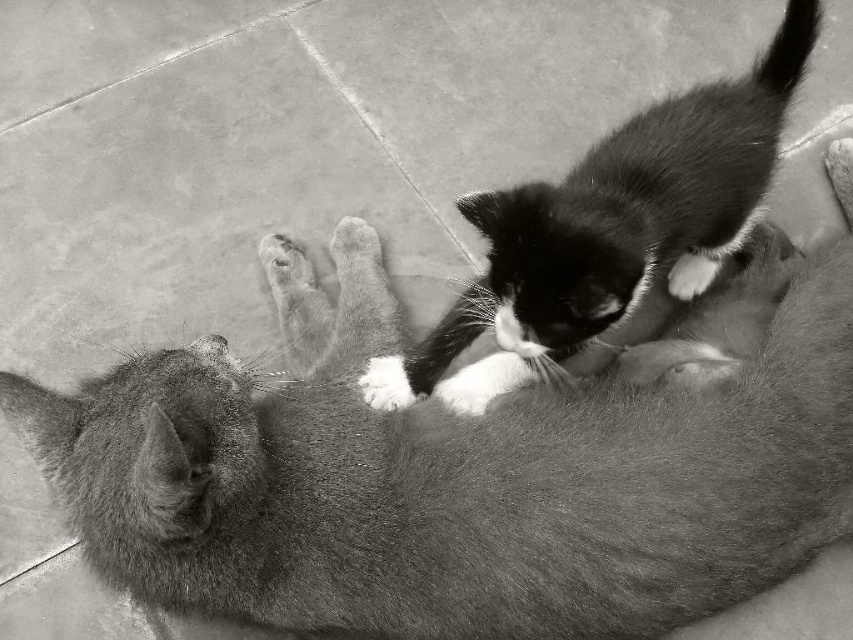
Is soft fur cat at center shorter than soft fur kitten at center?

Incorrect, soft fur cat at center's height does not fall short of soft fur kitten at center's.

Does soft fur cat at center appear on the left side of soft fur kitten at center?

Indeed, soft fur cat at center is positioned on the left side of soft fur kitten at center.

The width and height of the screenshot is (853, 640). I want to click on soft fur cat at center, so click(x=457, y=483).

Can you confirm if soft fur cat at center is taller than white fur paw at upper center?

Yes, soft fur cat at center is taller than white fur paw at upper center.

Is soft fur cat at center positioned before white fur paw at upper center?

Yes, soft fur cat at center is closer to the viewer.

Identify the location of soft fur cat at center. (457, 483).

You are a GUI agent. You are given a task and a screenshot of the screen. Output one action in this format:
    pyautogui.click(x=<x>, y=<y>)
    Task: Click on the soft fur cat at center
    The height and width of the screenshot is (640, 853).
    Given the screenshot: What is the action you would take?
    pyautogui.click(x=457, y=483)

Who is taller, white fluffy paw at upper center or white fluffy paw at center?

With more height is white fluffy paw at upper center.

Between white fluffy paw at upper center and white fluffy paw at center, which one appears on the left side from the viewer's perspective?

Positioned to the left is white fluffy paw at center.

Locate an element on the screen. The width and height of the screenshot is (853, 640). white fluffy paw at upper center is located at coordinates (483, 381).

This screenshot has height=640, width=853. I want to click on white fluffy paw at upper center, so click(483, 381).